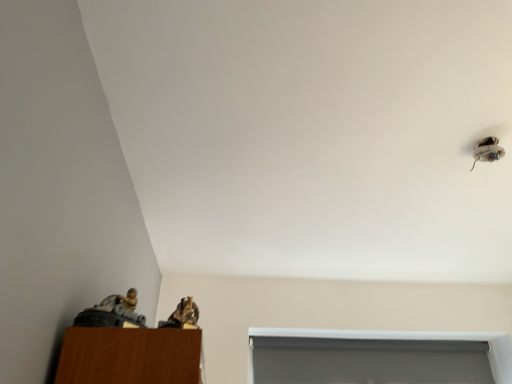
Question: From the image's perspective, would you say white glossy shoe at upper right is shown under white matte window at lower center?

Choices:
 (A) yes
 (B) no

Answer: (B)

Question: Is white glossy shoe at upper right to the left of white matte window at lower center from the viewer's perspective?

Choices:
 (A) no
 (B) yes

Answer: (A)

Question: Is white glossy shoe at upper right closer to the viewer compared to white matte window at lower center?

Choices:
 (A) no
 (B) yes

Answer: (B)

Question: Can you confirm if white glossy shoe at upper right is thinner than white matte window at lower center?

Choices:
 (A) no
 (B) yes

Answer: (A)

Question: Is white glossy shoe at upper right turned away from white matte window at lower center?

Choices:
 (A) yes
 (B) no

Answer: (A)

Question: From the image's perspective, is white glossy shoe at upper right above white matte window at lower center?

Choices:
 (A) yes
 (B) no

Answer: (A)

Question: Can you confirm if white glossy shoe at upper right is positioned to the right of brown textured figurine at lower left?

Choices:
 (A) yes
 (B) no

Answer: (A)

Question: From a real-world perspective, does white glossy shoe at upper right sit lower than brown textured figurine at lower left?

Choices:
 (A) no
 (B) yes

Answer: (A)

Question: From the image's perspective, is white glossy shoe at upper right over brown textured figurine at lower left?

Choices:
 (A) no
 (B) yes

Answer: (B)

Question: Considering the relative sizes of white glossy shoe at upper right and brown textured figurine at lower left in the image provided, is white glossy shoe at upper right shorter than brown textured figurine at lower left?

Choices:
 (A) no
 (B) yes

Answer: (B)

Question: From a real-world perspective, is white glossy shoe at upper right physically above brown textured figurine at lower left?

Choices:
 (A) yes
 (B) no

Answer: (A)

Question: Is white glossy shoe at upper right positioned behind brown textured figurine at lower left?

Choices:
 (A) yes
 (B) no

Answer: (A)

Question: Does brown textured figurine at lower left appear on the right side of white matte window at lower center?

Choices:
 (A) no
 (B) yes

Answer: (A)